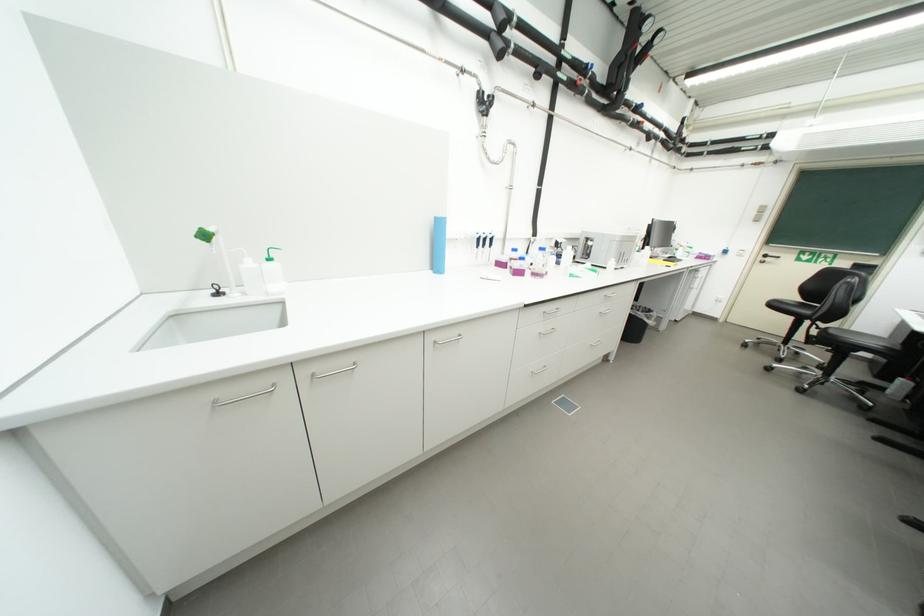
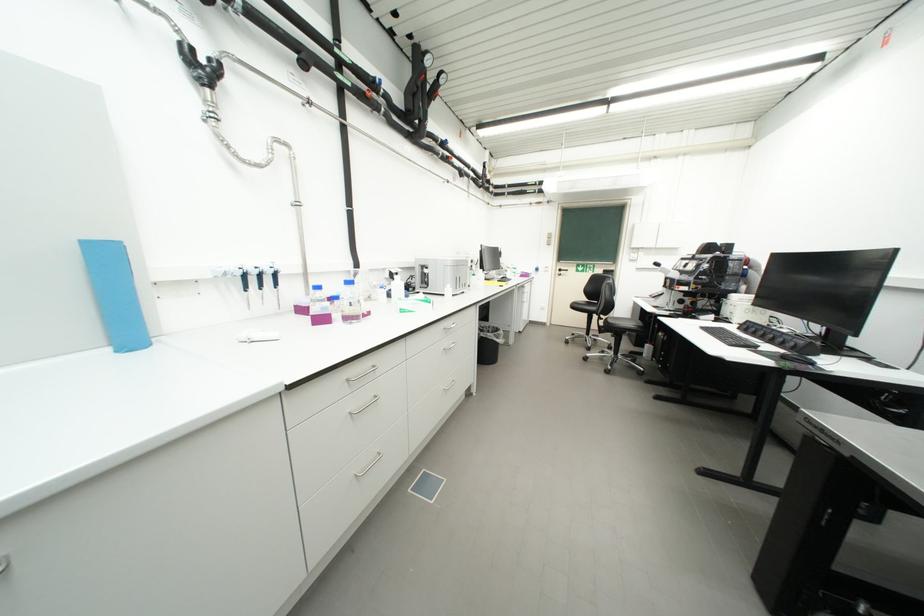
Locate, in the second image, the point that corresponds to (821,334) in the first image.

(610, 325)